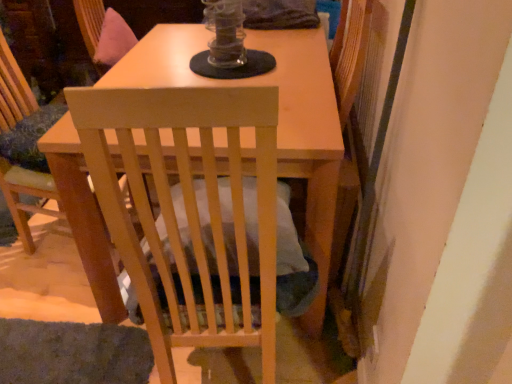
Question: Visually, is light wood chair at center, the 1th chair from the left, positioned to the left or to the right of wooden swivel chair at upper center?

Choices:
 (A) right
 (B) left

Answer: (B)

Question: From their relative heights in the image, would you say light wood chair at center, placed as the 2th chair when sorted from right to left, is taller or shorter than wooden swivel chair at upper center?

Choices:
 (A) tall
 (B) short

Answer: (A)

Question: Based on their relative distances, which object is farther from the light wood chair at center, the 1th chair from the left?

Choices:
 (A) wooden swivel chair at upper center
 (B) light wood chair at center, positioned as the second chair in left-to-right order

Answer: (B)

Question: Estimate the real-world distances between objects in this image. Which object is closer to the wooden swivel chair at upper center?

Choices:
 (A) light wood chair at center, the 1th chair when ordered from right to left
 (B) light wood chair at center, the 1th chair from the left

Answer: (B)